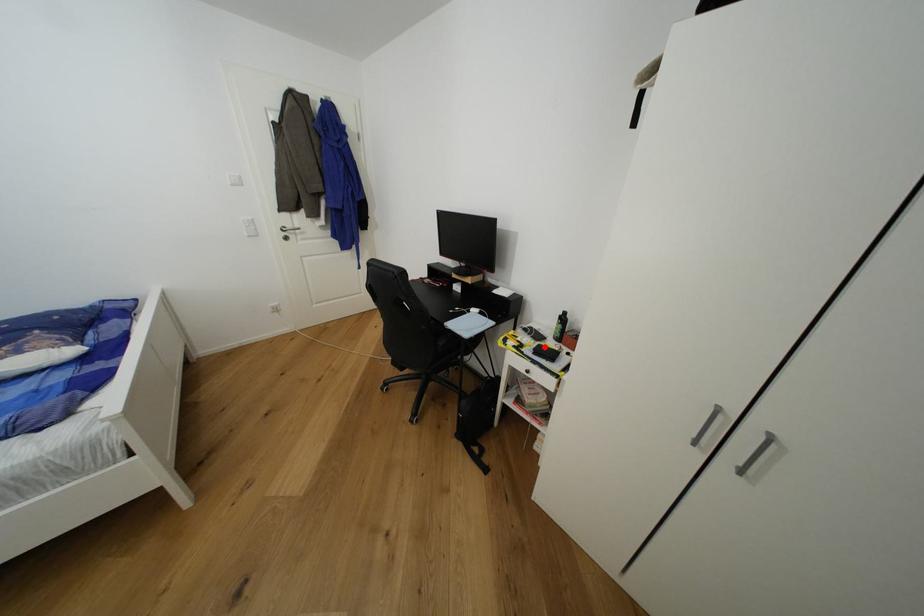
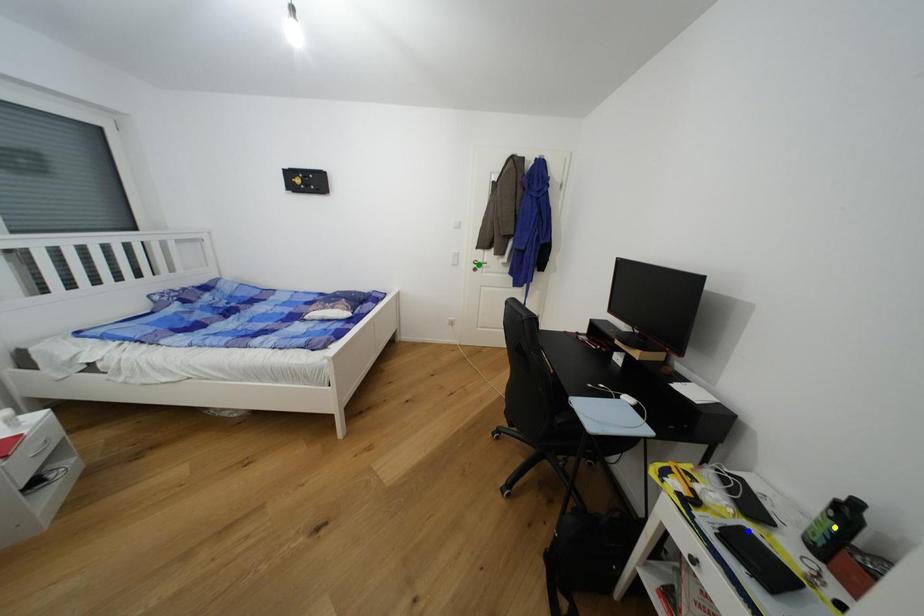
Question: I am providing you with two images of the same scene from different viewpoints. A red point is marked on the first image. You are given multiple points on the second image. Can you choose the point in image 2 that corresponds to the point in image 1?

Choices:
 (A) green point
 (B) blue point
 (C) yellow point

Answer: (B)